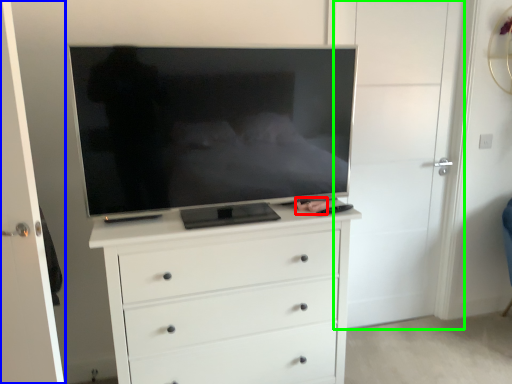
Question: Considering the real-world distances, which object is closest to person (highlighted by a red box)? door (highlighted by a blue box) or door (highlighted by a green box).

Choices:
 (A) door
 (B) door

Answer: (B)